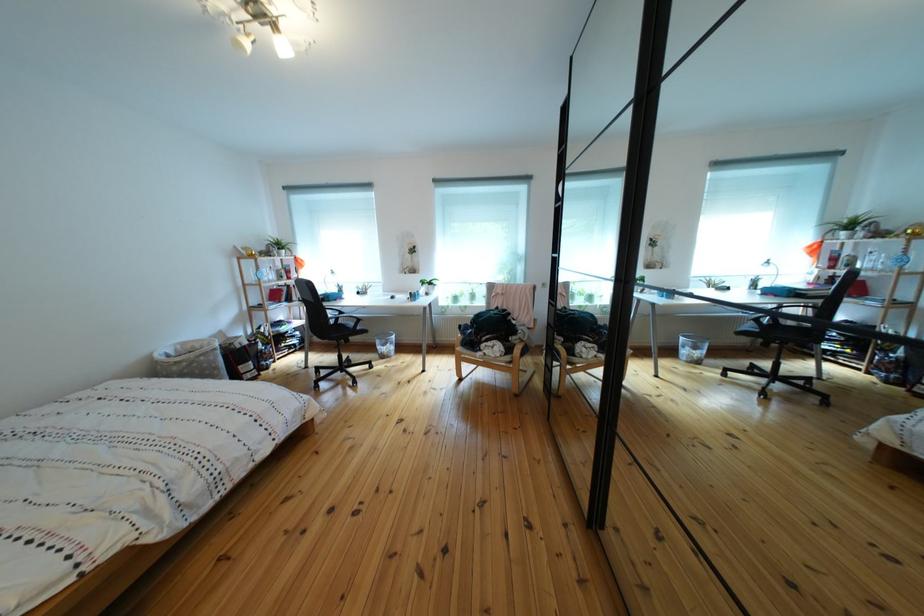
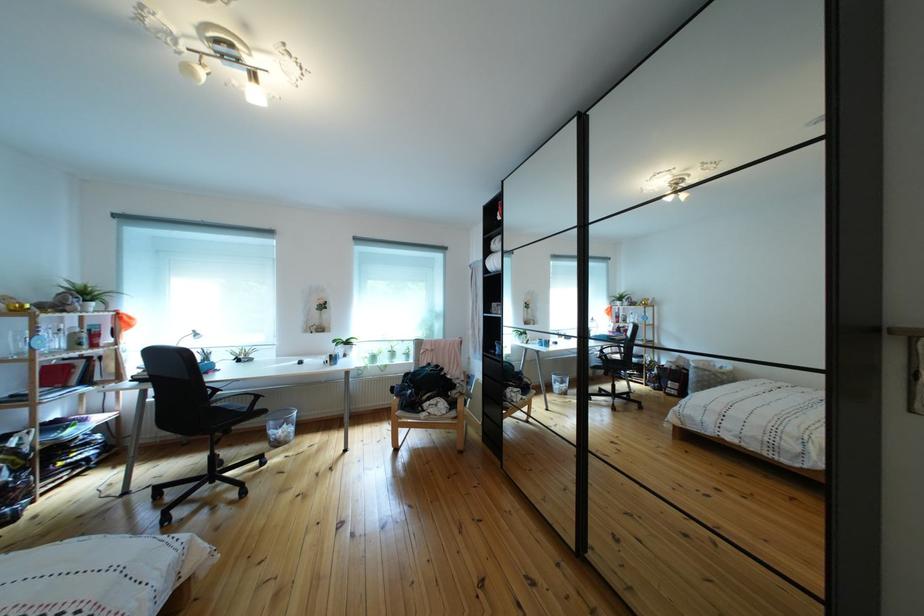
In the second image, find the point that corresponds to point (531, 337) in the first image.

(469, 391)